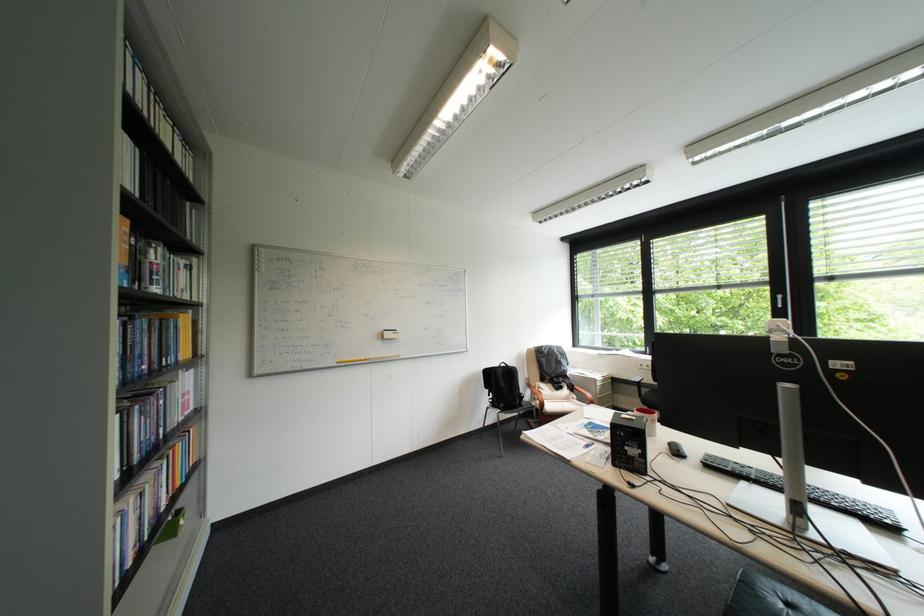
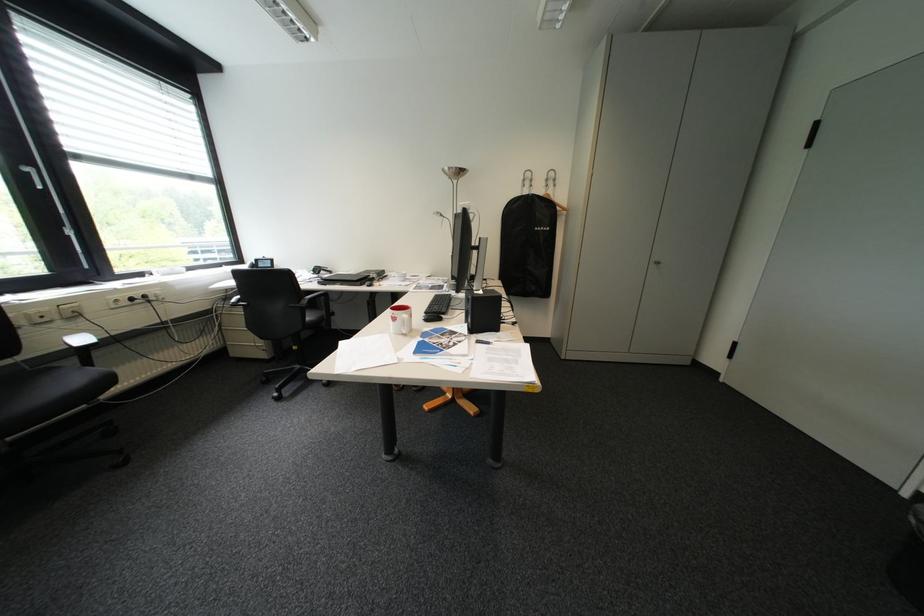
In the second image, find the point that corresponds to the point at 793,297 in the first image.

(41, 169)